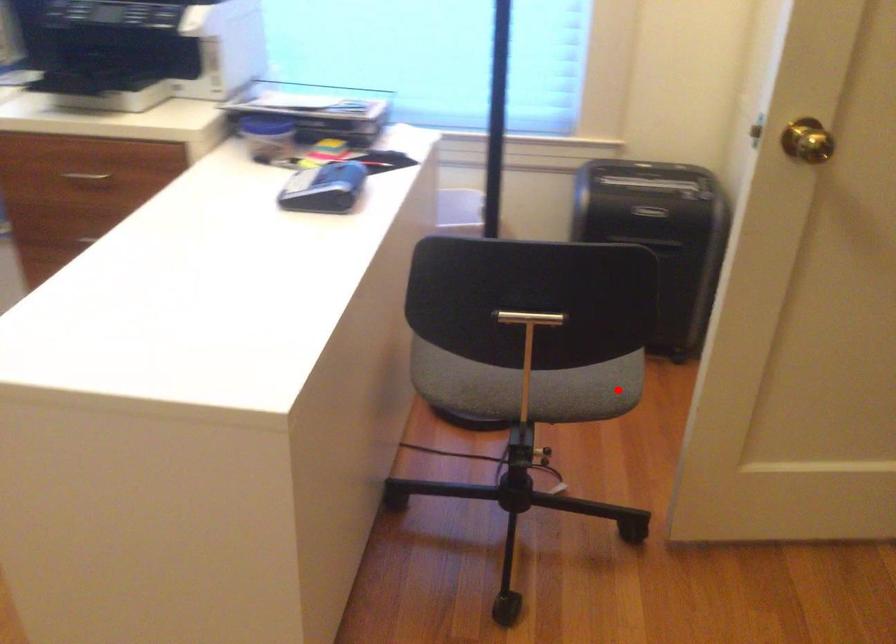
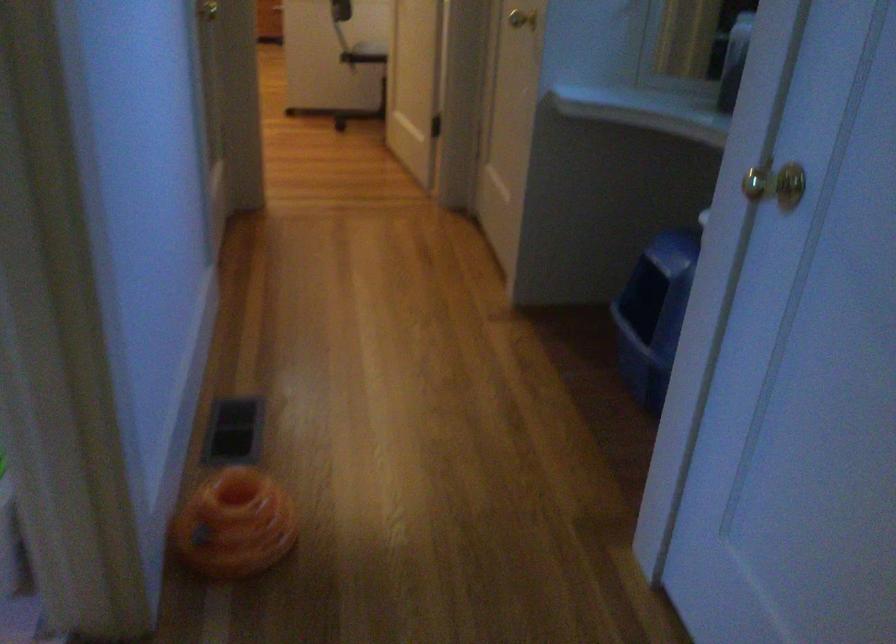
In the second image, find the point that corresponds to the highlighted location in the first image.

(371, 49)